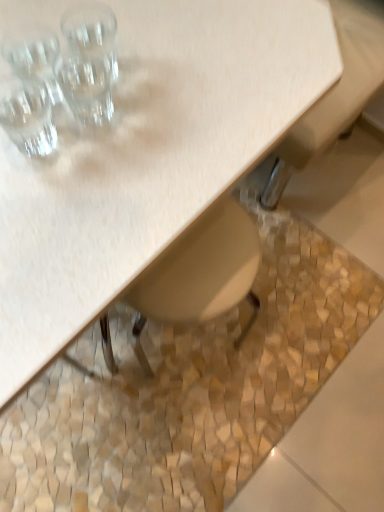
The image size is (384, 512). In order to click on unoccupied space behind clear glass shot glass at upper left, which appears as the 1th shot glass when ordered from the bottom in this screenshot , I will do `click(74, 49)`.